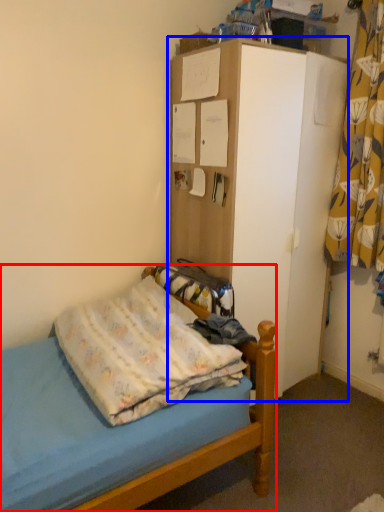
Question: Which object appears closest to the camera in this image, bed (highlighted by a red box) or dresser (highlighted by a blue box)?

Choices:
 (A) bed
 (B) dresser

Answer: (A)